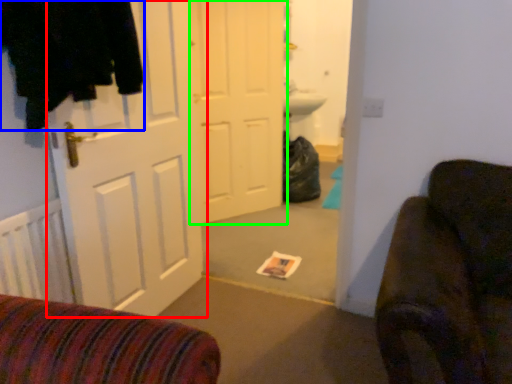
Question: Estimate the real-world distances between objects in this image. Which object is closer to door (highlighted by a red box), clothing (highlighted by a blue box) or door (highlighted by a green box)?

Choices:
 (A) clothing
 (B) door

Answer: (A)